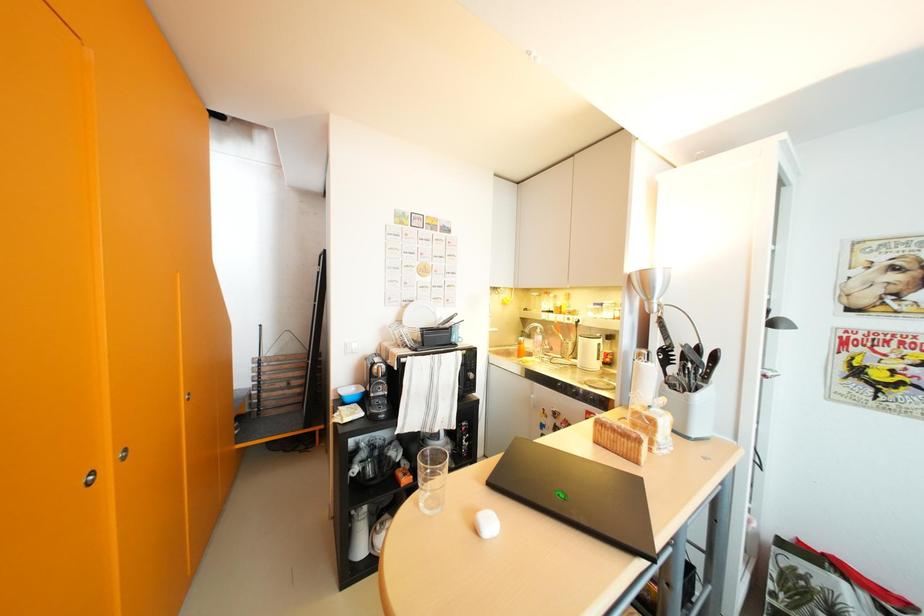
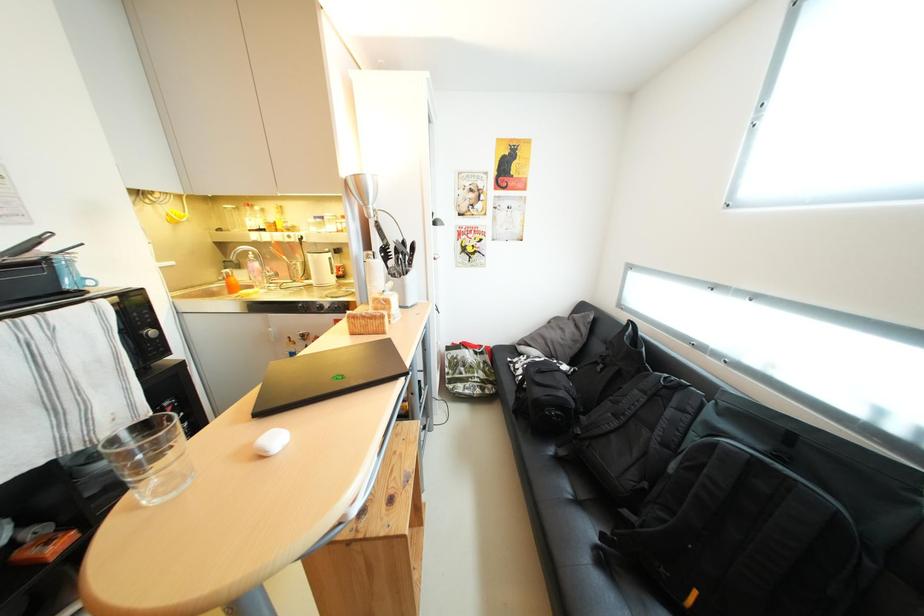
Based on the photo, first-person continuous shooting, in which direction is the camera rotating?

The camera's rotation is toward right-down.